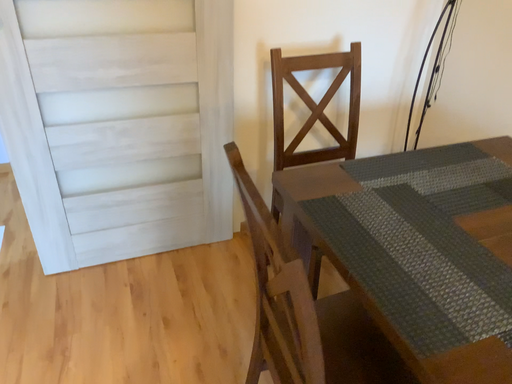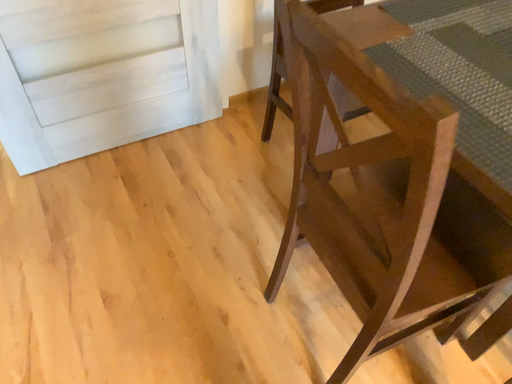
Question: Which way did the camera rotate in the video?

Choices:
 (A) rotated upward
 (B) rotated downward

Answer: (B)